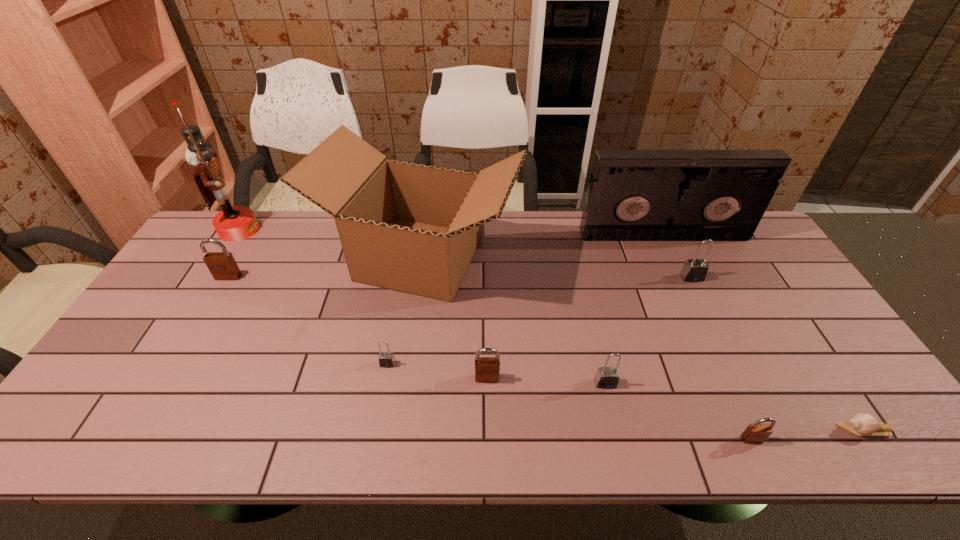
Where is `free space located on the shackle of the farthest gray padlock`? This screenshot has height=540, width=960. free space located on the shackle of the farthest gray padlock is located at coordinates (710, 315).

The height and width of the screenshot is (540, 960). I want to click on free space located 0.190m on the front-facing side of the biggest brown padlock, so click(198, 329).

In order to click on free space located on the front-facing side of the second brown padlock from right to left in this screenshot , I will do `click(488, 428)`.

Identify the location of vacant space situated on the shackle of the leftmost gray padlock. (378, 419).

The width and height of the screenshot is (960, 540). I want to click on vacant space situated on the shell of the escargot, so click(x=778, y=430).

The image size is (960, 540). Identify the location of free space located 0.230m on the shell of the escargot. (738, 430).

The image size is (960, 540). I want to click on vacant area located on the shell of the escargot, so click(x=738, y=430).

Locate an element on the screen. nutcracker present at the far edge is located at coordinates (233, 223).

The height and width of the screenshot is (540, 960). I want to click on box at the far edge, so [x=413, y=228].

At what (x,y) coordinates should I click in order to perform the action: click on videotape that is at the far edge. Please return your answer as a coordinate pair (x, y). Looking at the image, I should click on (633, 195).